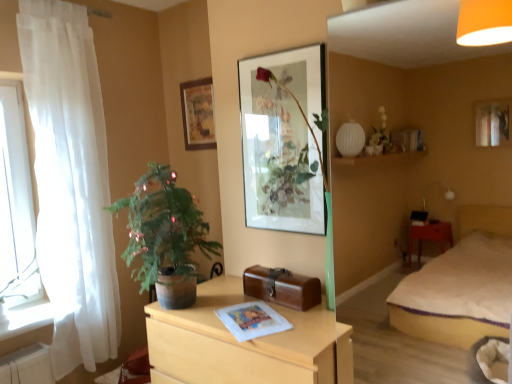
Describe the element at coordinates (71, 181) in the screenshot. I see `white sheer curtain at left` at that location.

The height and width of the screenshot is (384, 512). Describe the element at coordinates (284, 140) in the screenshot. I see `matte glass picture frame at center, placed as the first picture frame when sorted from right to left` at that location.

Find the location of a particular element. brown leather suitcase at center is located at coordinates (282, 287).

Can brown leather suitcase at center be found inside transparent glass window at left?

No.

From the image's perspective, is transparent glass window at left located above or below brown leather suitcase at center?

transparent glass window at left is above brown leather suitcase at center.

In terms of size, does transparent glass window at left appear bigger or smaller than brown leather suitcase at center?

Clearly, transparent glass window at left is larger in size than brown leather suitcase at center.

Can you confirm if transparent glass window at left is shorter than brown leather suitcase at center?

Incorrect, the height of transparent glass window at left does not fall short of that of brown leather suitcase at center.

Between white sheer curtain at left and green matte potted plant at left, which one has larger size?

Bigger between the two is white sheer curtain at left.

Is white sheer curtain at left inside or outside of green matte potted plant at left?

→ white sheer curtain at left is spatially situated outside green matte potted plant at left.

Is the depth of white sheer curtain at left greater than that of green matte potted plant at left?

Yes.

In terms of width, does white sheer curtain at left look wider or thinner when compared to green matte potted plant at left?

In the image, white sheer curtain at left appears to be more narrow than green matte potted plant at left.

Looking at this image, is wooden picture frame at upper center, which is counted as the 2th picture frame, starting from the front, taller or shorter than matte glass picture frame at center, arranged as the 1th picture frame when viewed from the front?

Clearly, wooden picture frame at upper center, which is counted as the 2th picture frame, starting from the front, is shorter compared to matte glass picture frame at center, arranged as the 1th picture frame when viewed from the front.

From the image's perspective, between wooden picture frame at upper center, which is the first picture frame in left-to-right order, and matte glass picture frame at center, placed as the first picture frame when sorted from right to left, which one is located above?

wooden picture frame at upper center, which is the first picture frame in left-to-right order, appears higher in the image.

Between wooden picture frame at upper center, the 2th picture frame positioned from the right, and matte glass picture frame at center, the 2th picture frame from the left, which one has smaller width?

Thinner between the two is wooden picture frame at upper center, the 2th picture frame positioned from the right.

Considering the sizes of objects green matte potted plant at left and matte glass picture frame at center, the second picture frame from the back, in the image provided, who is taller, green matte potted plant at left or matte glass picture frame at center, the second picture frame from the back,?

With more height is matte glass picture frame at center, the second picture frame from the back.

From the image's perspective, is green matte potted plant at left on matte glass picture frame at center, placed as the first picture frame when sorted from right to left?

No.

From a real-world perspective, which object rests below the other?

In real-world perspective, green matte potted plant at left is lower.

Which object is positioned more to the left, green matte potted plant at left or matte glass picture frame at center, the 2th picture frame from the left?

Positioned to the left is green matte potted plant at left.

Consider the image. Would you consider brown leather suitcase at center to be distant from wooden chest of drawers at center?

That's not correct — brown leather suitcase at center is a little close to wooden chest of drawers at center.

From a real-world perspective, who is located lower, brown leather suitcase at center or wooden chest of drawers at center?

From a 3D spatial view, wooden chest of drawers at center is below.

Consider the image. Which object is further away from the camera taking this photo, brown leather suitcase at center or wooden chest of drawers at center?

brown leather suitcase at center is more distant.

Looking at this image, can you confirm if white sheer curtain at left is positioned to the left of brown leather suitcase at center?

Yes.

From the picture: Which of these two, white sheer curtain at left or brown leather suitcase at center, is thinner?

white sheer curtain at left is thinner.

Considering the sizes of objects white sheer curtain at left and brown leather suitcase at center in the image provided, who is taller, white sheer curtain at left or brown leather suitcase at center?

With more height is white sheer curtain at left.

From a real-world perspective, is white sheer curtain at left below brown leather suitcase at center?

Incorrect, from a real-world perspective, white sheer curtain at left is higher than brown leather suitcase at center.

Which object is thinner, white sheer curtain at left or wooden picture frame at upper center, which is the first picture frame in left-to-right order?

Thinner between the two is wooden picture frame at upper center, which is the first picture frame in left-to-right order.

Is white sheer curtain at left oriented away from wooden picture frame at upper center, which is the first picture frame in left-to-right order?

No.

Where is `curtain in front of the wooden picture frame at upper center, marked as the first picture frame in a back-to-front arrangement`? The height and width of the screenshot is (384, 512). curtain in front of the wooden picture frame at upper center, marked as the first picture frame in a back-to-front arrangement is located at coordinates (71, 181).

I want to click on window located on the left of brown leather suitcase at center, so click(16, 204).

What are the coordinates of `houseplant located on the right of white sheer curtain at left` in the screenshot? It's located at (165, 236).

Looking at the image, which one is located closer to transparent glass window at left, matte glass picture frame at center, arranged as the 1th picture frame when viewed from the front, or wooden chest of drawers at center?

wooden chest of drawers at center lies closer to transparent glass window at left than the other object.

When comparing their distances from wooden chest of drawers at center, does green matte potted plant at left or white sheer curtain at left seem further?

Among the two, white sheer curtain at left is located further to wooden chest of drawers at center.

When comparing their distances from wooden chest of drawers at center, does transparent glass window at left or white sheer curtain at left seem closer?

Among the two, white sheer curtain at left is located nearer to wooden chest of drawers at center.

Estimate the real-world distances between objects in this image. Which object is closer to matte glass picture frame at center, arranged as the 1th picture frame when viewed from the front, wooden picture frame at upper center, marked as the first picture frame in a back-to-front arrangement, or wooden chest of drawers at center?

Among the two, wooden chest of drawers at center is located nearer to matte glass picture frame at center, arranged as the 1th picture frame when viewed from the front.

Looking at this image, looking at the image, which one is located closer to brown leather suitcase at center, transparent glass window at left or white sheer curtain at left?

white sheer curtain at left lies closer to brown leather suitcase at center than the other object.

Considering their positions, is brown leather suitcase at center positioned further to transparent glass window at left than wooden picture frame at upper center, marked as the first picture frame in a back-to-front arrangement?

brown leather suitcase at center lies further to transparent glass window at left than the other object.

Estimate the real-world distances between objects in this image. Which object is further from transparent glass window at left, wooden chest of drawers at center or green matte potted plant at left?

Based on the image, wooden chest of drawers at center appears to be further to transparent glass window at left.

Consider the image. Estimate the real-world distances between objects in this image. Which object is closer to white sheer curtain at left, transparent glass window at left or wooden chest of drawers at center?

Among the two, transparent glass window at left is located nearer to white sheer curtain at left.

Locate an element on the screen. The image size is (512, 384). houseplant between matte glass picture frame at center, the second picture frame from the back, and wooden chest of drawers at center vertically is located at coordinates (165, 236).

You are a GUI agent. You are given a task and a screenshot of the screen. Output one action in this format:
    pyautogui.click(x=<x>, y=<y>)
    Task: Click on the luggage between green matte potted plant at left and wooden picture frame at upper center, which is the first picture frame in left-to-right order, in the front-back direction
    Image resolution: width=512 pixels, height=384 pixels.
    Given the screenshot: What is the action you would take?
    point(282,287)

Locate an element on the screen. houseplant located between white sheer curtain at left and matte glass picture frame at center, arranged as the 1th picture frame when viewed from the front, in the left-right direction is located at coordinates (165, 236).

This screenshot has height=384, width=512. Identify the location of picture frame between wooden picture frame at upper center, which is counted as the 2th picture frame, starting from the front, and wooden chest of drawers at center from top to bottom. (284, 140).